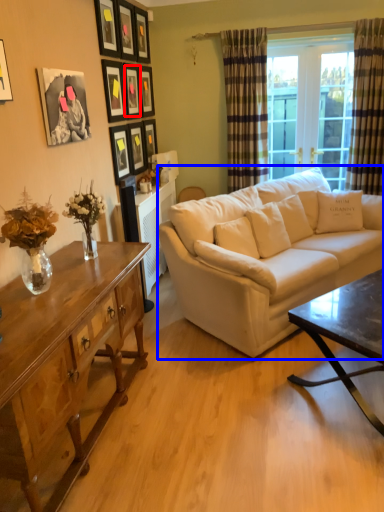
Question: Among these objects, which one is farthest to the camera, picture frame (highlighted by a red box) or studio couch (highlighted by a blue box)?

Choices:
 (A) picture frame
 (B) studio couch

Answer: (A)